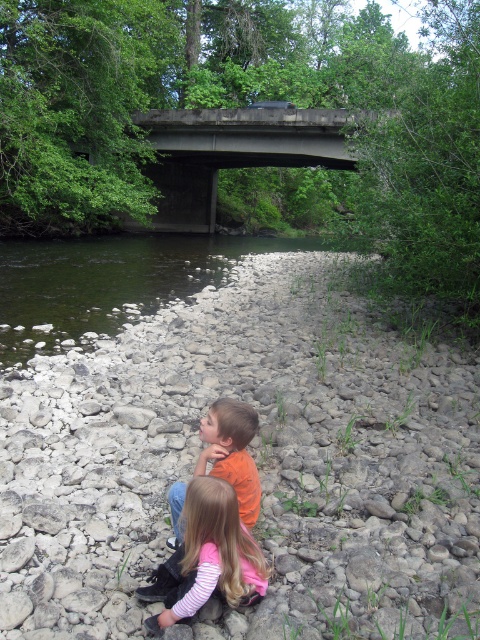
Who is taller, gray rocky river bank at lower center or light pink striped shirt at lower center?

gray rocky river bank at lower center is taller.

Who is more distant from viewer, (x=157, y=534) or (x=206, y=541)?

Positioned behind is point (x=157, y=534).

You are a GUI agent. You are given a task and a screenshot of the screen. Output one action in this format:
    pyautogui.click(x=<x>, y=<y>)
    Task: Click on the gray rocky river bank at lower center
    The image size is (480, 640).
    Given the screenshot: What is the action you would take?
    pyautogui.click(x=251, y=458)

Which is behind, point (423, 356) or point (255, 513)?

The point (423, 356) is more distant.

This screenshot has width=480, height=640. Identify the location of gray rocky river bank at lower center. (251, 458).

Between green smooth water at center and orange matte shirt at center, which one has less height?

orange matte shirt at center

Looking at this image, how far apart are green smooth water at center and orange matte shirt at center?

green smooth water at center is 13.36 meters away from orange matte shirt at center.

Is point (113, 264) less distant than point (252, 490)?

No, (113, 264) is behind (252, 490).

Find the location of `green smooth water at center`. green smooth water at center is located at coordinates (109, 280).